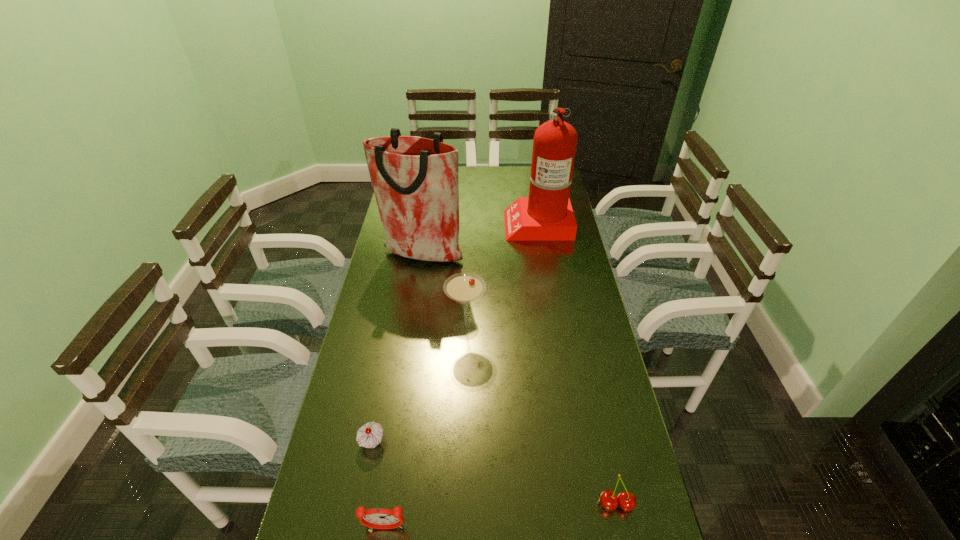
At what (x,y) coordinates should I click in order to perform the action: click on object identified as the fourth closest to the fire extinguisher. Please return your answer as a coordinate pair (x, y). The image size is (960, 540). Looking at the image, I should click on (627, 501).

Where is `vacant space that satisfies the following two spatial constraints: 1. on the front-facing side of the fire extinguisher; 2. on the front-facing side of the nearest object`? vacant space that satisfies the following two spatial constraints: 1. on the front-facing side of the fire extinguisher; 2. on the front-facing side of the nearest object is located at coordinates (588, 528).

The width and height of the screenshot is (960, 540). Find the location of `free spot that satisfies the following two spatial constraints: 1. on the front-facing side of the fire extinguisher; 2. on the front-facing side of the alarm clock`. free spot that satisfies the following two spatial constraints: 1. on the front-facing side of the fire extinguisher; 2. on the front-facing side of the alarm clock is located at coordinates (588, 528).